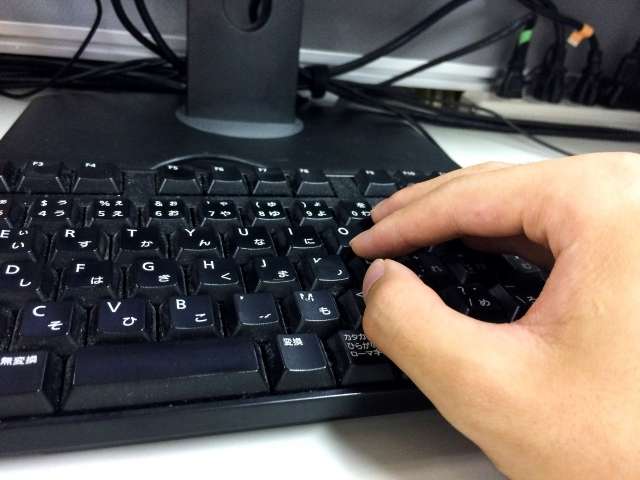
At what (x,y) coordinates should I click in order to perform the action: click on cords. Please return your answer as a coordinate pair (x, y). Image resolution: width=640 pixels, height=480 pixels. Looking at the image, I should click on (336, 93).